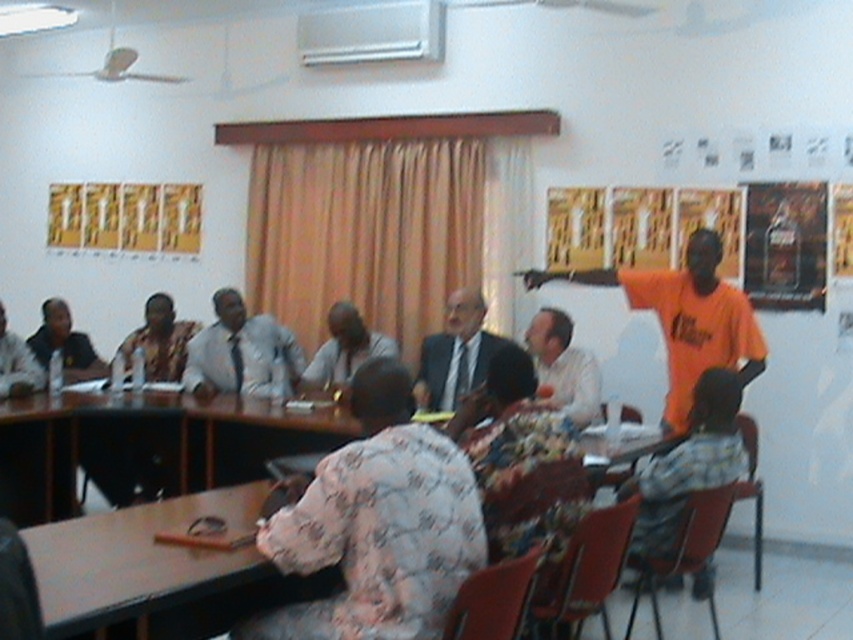
From the picture: You are attending a meeting in this room and need to hand a document to the person wearing the floral fabric dress at lower right. Since you are standing at the entrance, which is to the left of the white glossy shirt at center, can you directly hand the document to the person without moving around the table?

The floral fabric dress at lower right is positioned under the white glossy shirt at center, meaning the person in the white glossy shirt at center is sitting in front of the person in the floral fabric dress at lower right. Therefore, you cannot directly hand the document to the person in the floral fabric dress at lower right without moving around the table.